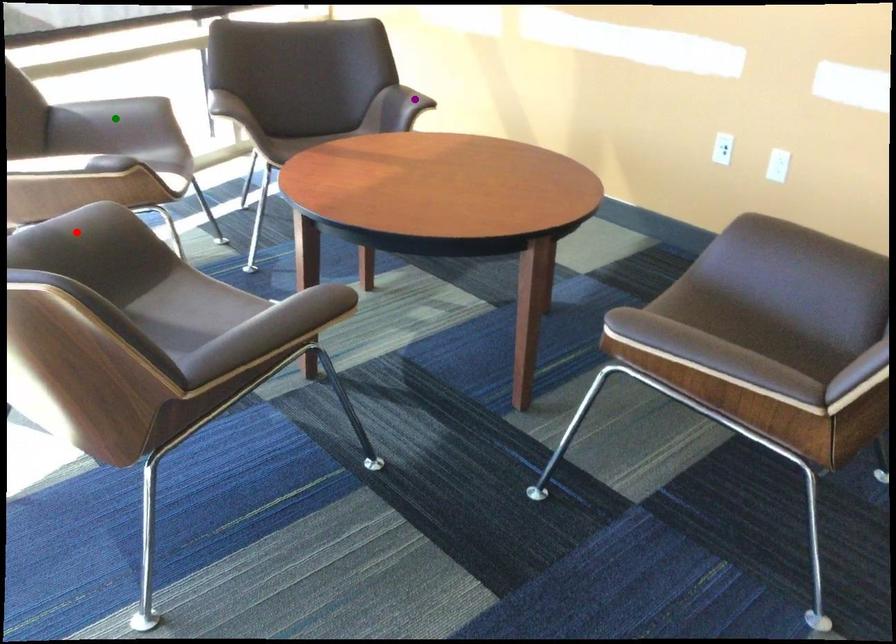
Order these from farthest to nearest:
- red point
- purple point
- green point

purple point, green point, red point